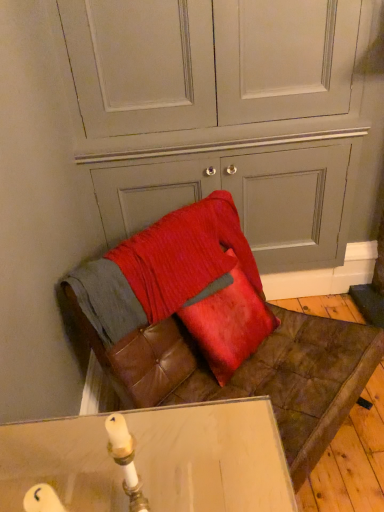
Question: Is leather cushion at lower center located within satin red pillow at center?

Choices:
 (A) yes
 (B) no

Answer: (B)

Question: Is satin red pillow at center looking in the opposite direction of leather cushion at lower center?

Choices:
 (A) no
 (B) yes

Answer: (B)

Question: Is satin red pillow at center bigger than leather cushion at lower center?

Choices:
 (A) no
 (B) yes

Answer: (A)

Question: Does satin red pillow at center have a greater height compared to leather cushion at lower center?

Choices:
 (A) no
 (B) yes

Answer: (A)

Question: From a real-world perspective, is satin red pillow at center on leather cushion at lower center?

Choices:
 (A) no
 (B) yes

Answer: (B)

Question: Does point (231, 355) appear closer or farther from the camera than point (362, 117)?

Choices:
 (A) closer
 (B) farther

Answer: (A)

Question: Considering the relative positions of satin red pillow at center and leather cushion at lower center in the image provided, is satin red pillow at center to the left or to the right of leather cushion at lower center?

Choices:
 (A) right
 (B) left

Answer: (A)

Question: Considering their positions, is satin red pillow at center located in front of or behind leather cushion at lower center?

Choices:
 (A) front
 (B) behind

Answer: (A)

Question: In terms of width, does satin red pillow at center look wider or thinner when compared to leather cushion at lower center?

Choices:
 (A) wide
 (B) thin

Answer: (B)

Question: In terms of width, does leather cushion at lower center look wider or thinner when compared to satin red pillow at center?

Choices:
 (A) wide
 (B) thin

Answer: (A)

Question: Is point (210, 387) closer or farther from the camera than point (269, 327)?

Choices:
 (A) closer
 (B) farther

Answer: (A)

Question: Choose the correct answer: Is leather cushion at lower center inside satin red pillow at center or outside it?

Choices:
 (A) outside
 (B) inside

Answer: (A)

Question: From a real-world perspective, is leather cushion at lower center physically located above or below satin red pillow at center?

Choices:
 (A) below
 (B) above

Answer: (A)

Question: Is leather cushion at lower center bigger or smaller than leather cushion at lower center?

Choices:
 (A) big
 (B) small

Answer: (A)

Question: From a real-world perspective, relative to leather cushion at lower center, is leather cushion at lower center vertically above or below?

Choices:
 (A) below
 (B) above

Answer: (B)